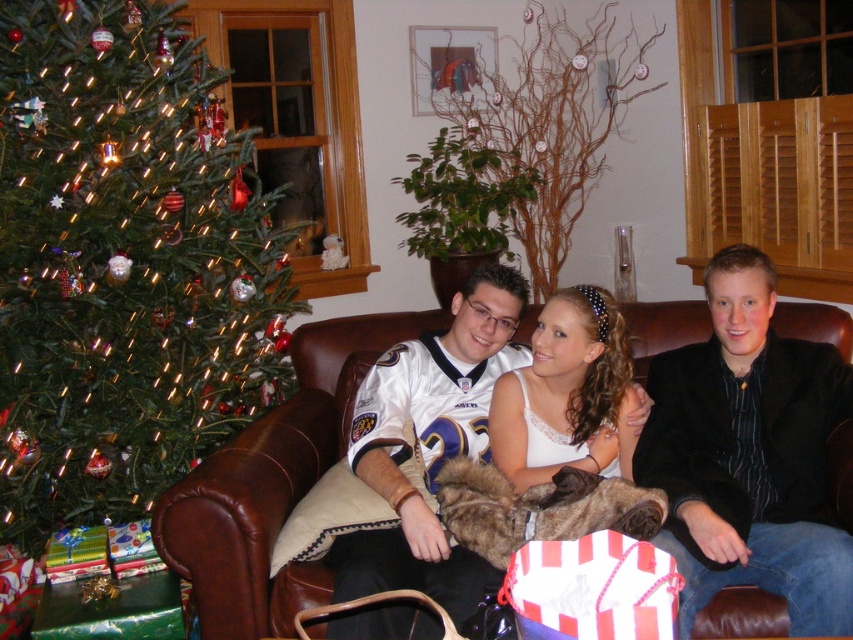
This screenshot has width=853, height=640. What do you see at coordinates (273, 483) in the screenshot?
I see `brown leather couch at center` at bounding box center [273, 483].

Is brown leather couch at center taller than white jersey at center?

No, brown leather couch at center is not taller than white jersey at center.

Between point (674, 340) and point (469, 314), which one is positioned behind?

Positioned behind is point (674, 340).

I want to click on brown leather couch at center, so click(x=273, y=483).

Does green matte christmas tree at left appear under white jersey at center?

No, green matte christmas tree at left is not below white jersey at center.

Which is behind, point (146, 19) or point (357, 476)?

The point (146, 19) is behind.

Is point (106, 461) closer to viewer compared to point (506, 348)?

Yes.

The width and height of the screenshot is (853, 640). Find the location of `green matte christmas tree at left`. green matte christmas tree at left is located at coordinates (125, 266).

Which is below, black smooth jacket at center or brown leather couch at center?

black smooth jacket at center is below.

Is black smooth jacket at center shorter than brown leather couch at center?

In fact, black smooth jacket at center may be taller than brown leather couch at center.

Is point (820, 388) positioned in front of point (194, 548)?

No, it is behind (194, 548).

Where is `black smooth jacket at center`? black smooth jacket at center is located at coordinates (749, 454).